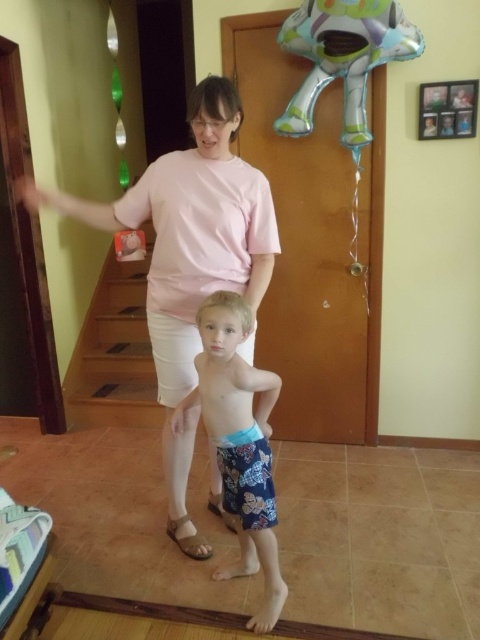
Question: Is tan suede sandal at lower center positioned before brown leather sandal at lower center?

Choices:
 (A) no
 (B) yes

Answer: (B)

Question: Is pink cotton shirt at upper center above metallic silver balloon at upper center?

Choices:
 (A) yes
 (B) no

Answer: (B)

Question: From the image, what is the correct spatial relationship of metallic silver balloon at upper center in relation to tan suede sandal at lower center?

Choices:
 (A) left
 (B) right

Answer: (B)

Question: Which object appears closest to the camera in this image?

Choices:
 (A) pink cotton shirt at upper center
 (B) tan suede sandal at lower center
 (C) brown leather sandal at lower center

Answer: (A)

Question: Which is farther from the brown leather sandal at lower center?

Choices:
 (A) pink cotton shirt at upper center
 (B) tan suede sandal at lower center

Answer: (A)

Question: Which of the following is the closest to the observer?

Choices:
 (A) (211, 166)
 (B) (337, 4)
 (C) (181, 419)
 (D) (228, 525)

Answer: (A)